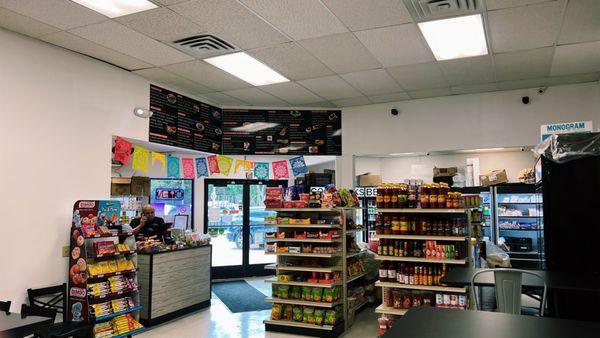
Locate an element on the screen. This screenshot has width=600, height=338. chair is located at coordinates (63, 308), (32, 310), (1, 303), (505, 284).